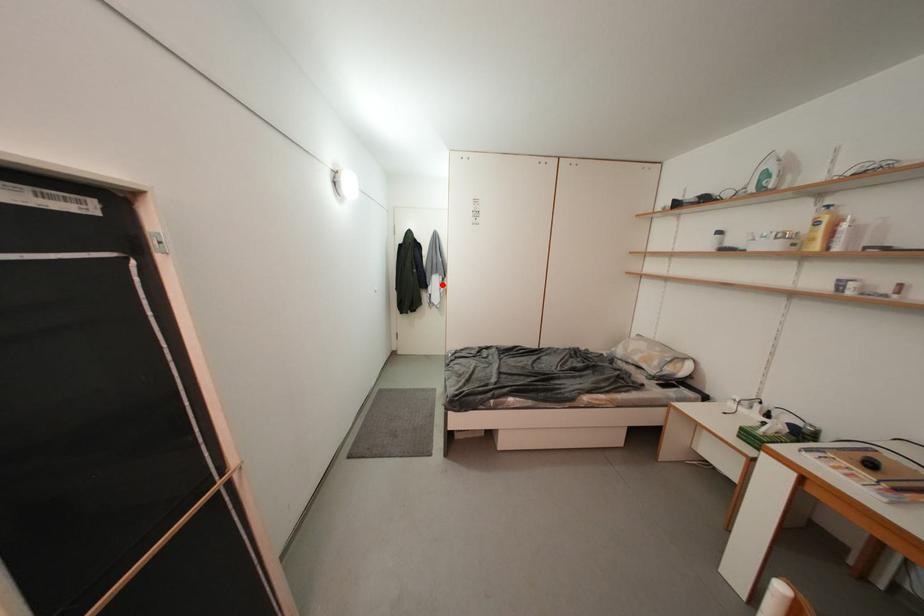
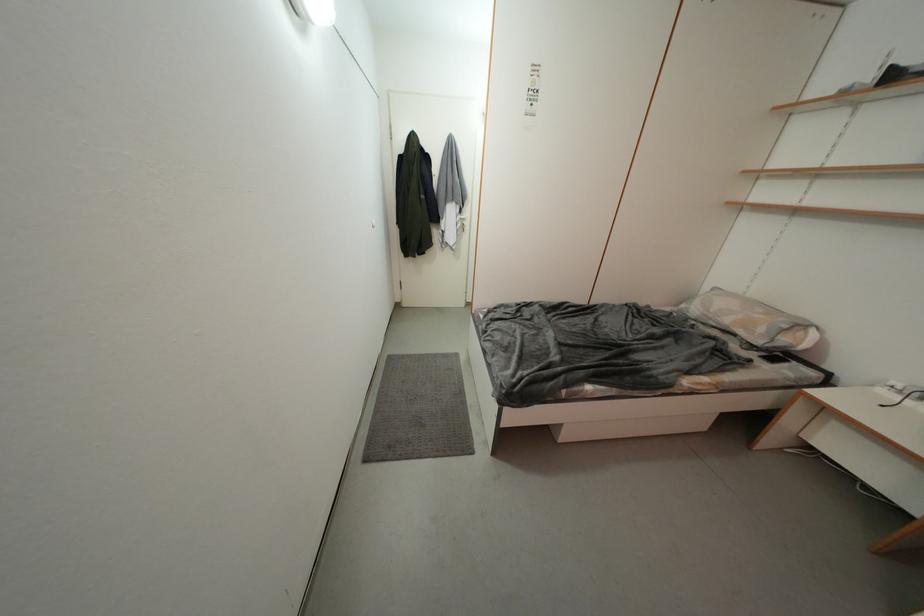
Find the pixel in the second image that matches the highlighted location in the first image.

(457, 216)